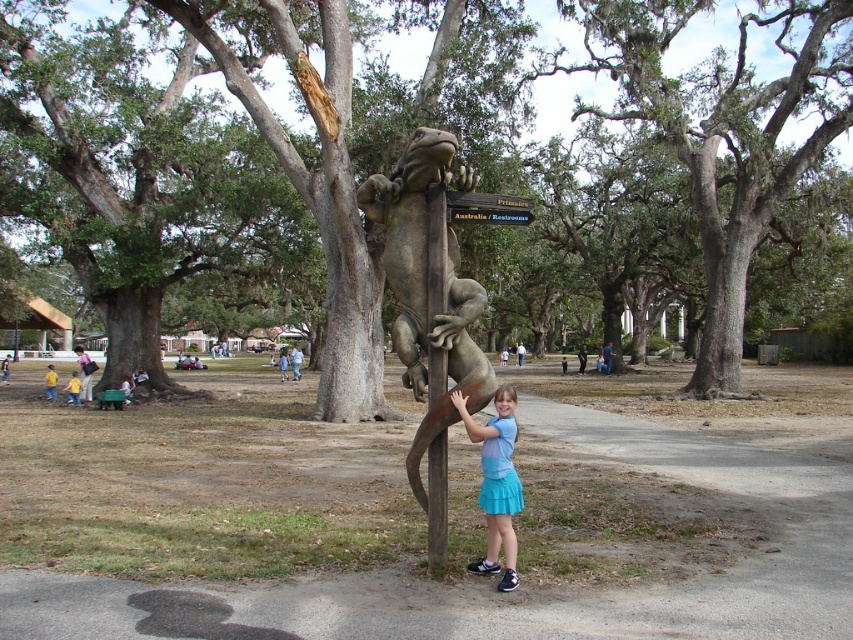
Question: Where is smooth gray lizard at center located in relation to light blue fabric skirt at center in the image?

Choices:
 (A) right
 (B) left

Answer: (B)

Question: Among these objects, which one is nearest to the camera?

Choices:
 (A) brown wood pole at center
 (B) green mossy tree at center

Answer: (A)

Question: From the image, what is the correct spatial relationship of green mossy tree at center in relation to brown wood pole at center?

Choices:
 (A) above
 (B) below

Answer: (A)

Question: Which point is farther to the camera?

Choices:
 (A) wooden sign at center
 (B) brown wood pole at center

Answer: (A)

Question: Which of these objects is positioned farthest from the bronze textured lizard at center?

Choices:
 (A) wooden sign at center
 (B) smooth gray lizard at center
 (C) green mossy tree at center

Answer: (C)

Question: Is smooth gray lizard at center thinner than bronze textured lizard at center?

Choices:
 (A) no
 (B) yes

Answer: (A)